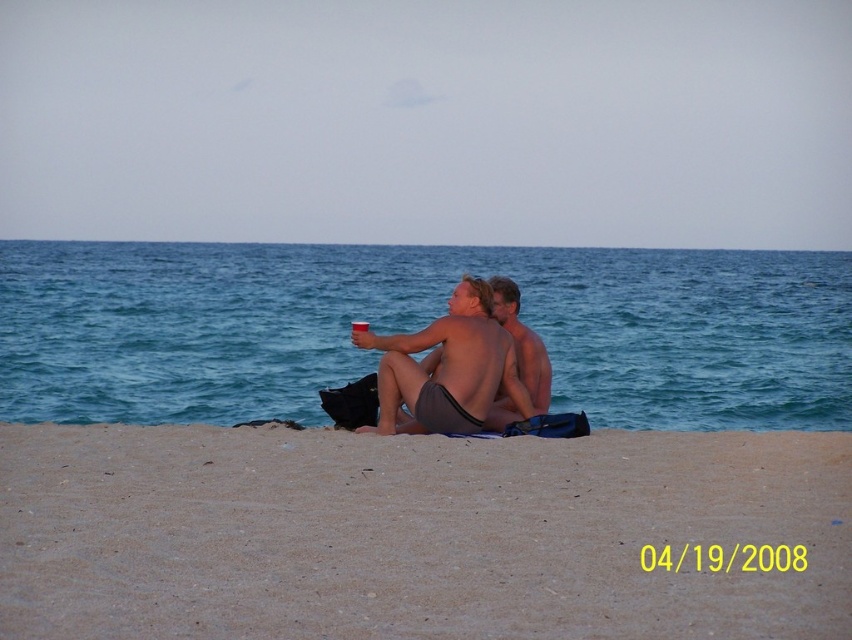
You are a photographer taking a portrait of two people on the beach. You notice the matte skin at center and the smooth skin torso at center. Which of these two areas should you focus on if you want to capture a larger portion of the subject in your photo?

The matte skin at center is larger in size than the smooth skin torso at center, so focusing on the matte skin at center would capture a larger portion of the subject in the photo.

You are a photographer trying to capture the texture of the brown sand at lower center and the matte skin at center. Based on their sizes, which one would be harder to focus on in a closeup shot?

The brown sand at lower center has a smaller size compared to matte skin at center, so it would be harder to focus on in a closeup shot because smaller objects require more precise focus and may be more challenging to capture clearly.